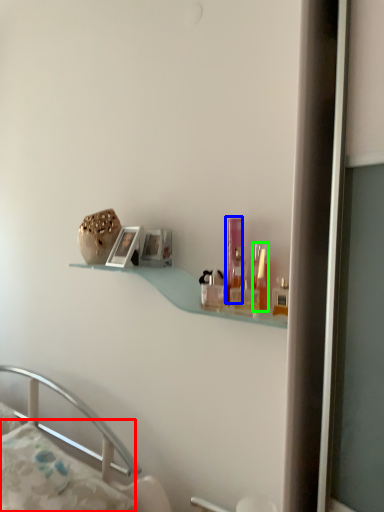
Question: Which object is positioned closest to pillow (highlighted by a red box)? Select from toiletry (highlighted by a blue box) and toiletry (highlighted by a green box).

Choices:
 (A) toiletry
 (B) toiletry

Answer: (A)